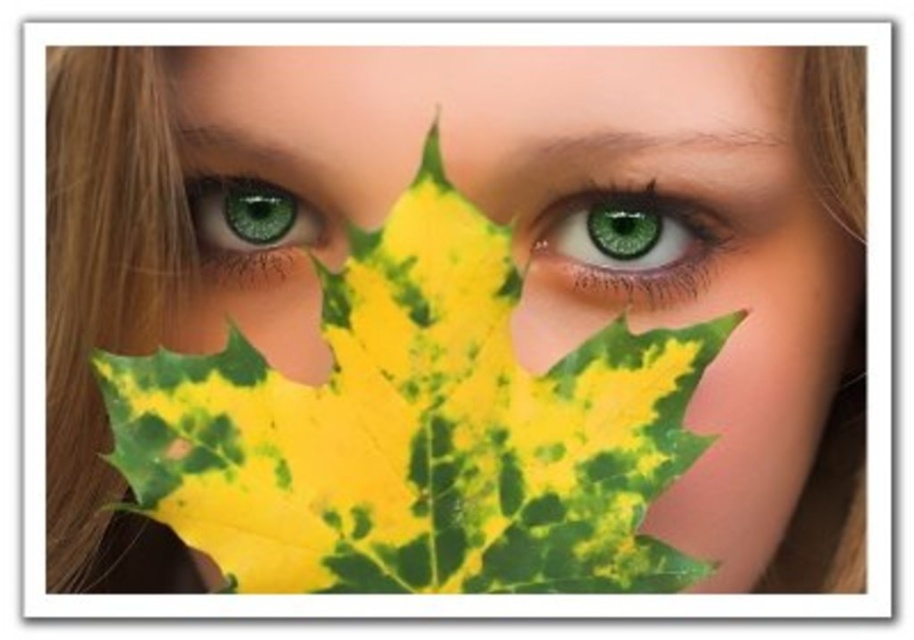
You are an artist trying to draw this scene. You want to ensure the depth perception is accurate. Which of the two points, point [600,220] or point [246,218], should you draw closer to the viewer to maintain the correct perspective?

Point [600,220] should be drawn closer to the viewer because it is closer to the camera than point [246,218] according to the description.

You are a photographer using a camera with a 50mm lens. You want to take a portrait where the green matte eye at center is in focus while keeping the leaf out of focus. Given that the minimum focusing distance for your camera is 18 inches, will you be able to achieve this effect?

The green matte eye at center and camera are 17.23 inches apart from each other. Since the minimum focusing distance is 18 inches, the camera cannot focus on the green matte eye at center, so achieving the desired effect is not possible.